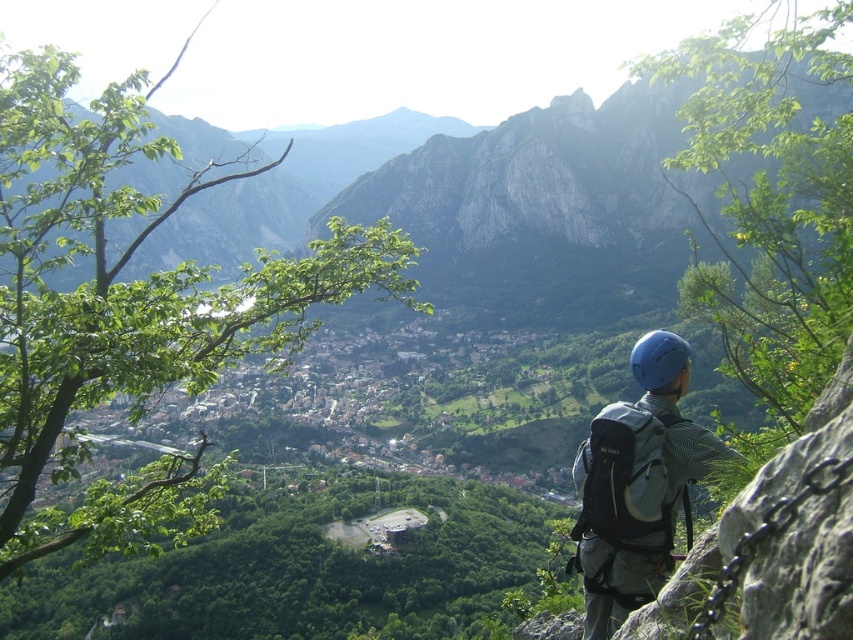
You are a hiker who just arrived at this scenic overlook. You notice your matte gray backpack at center right and blue matte helmet at center. Which item is located to the left of the other?

The matte gray backpack at center right is positioned on the left side of blue matte helmet at center, so the backpack is to the left of the helmet.